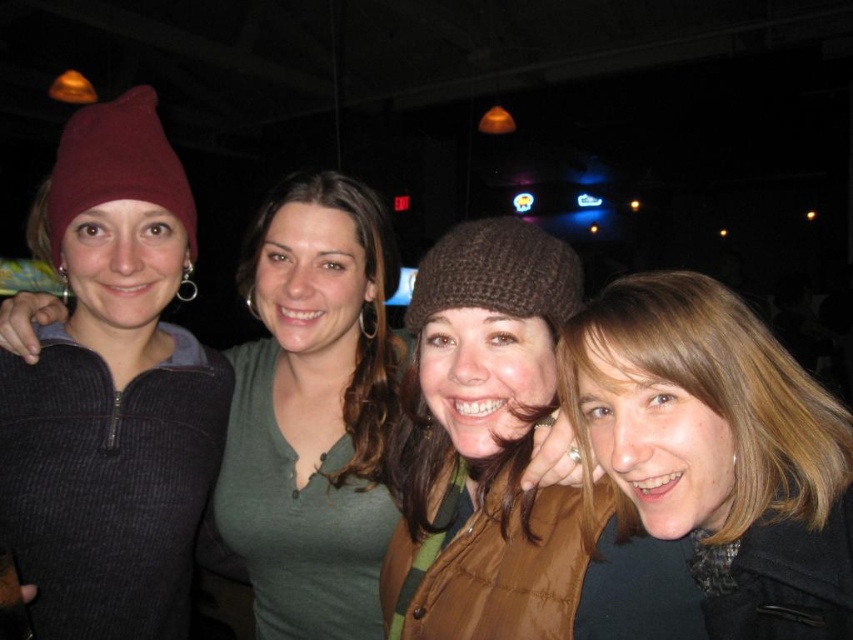
You are a photographer at this event and want to take a photo of the blonde hair at center and the knitted brown hat at center. Which object is closer to the camera?

The blonde hair at center is closer to the camera because it is in front of the knitted brown hat at center.